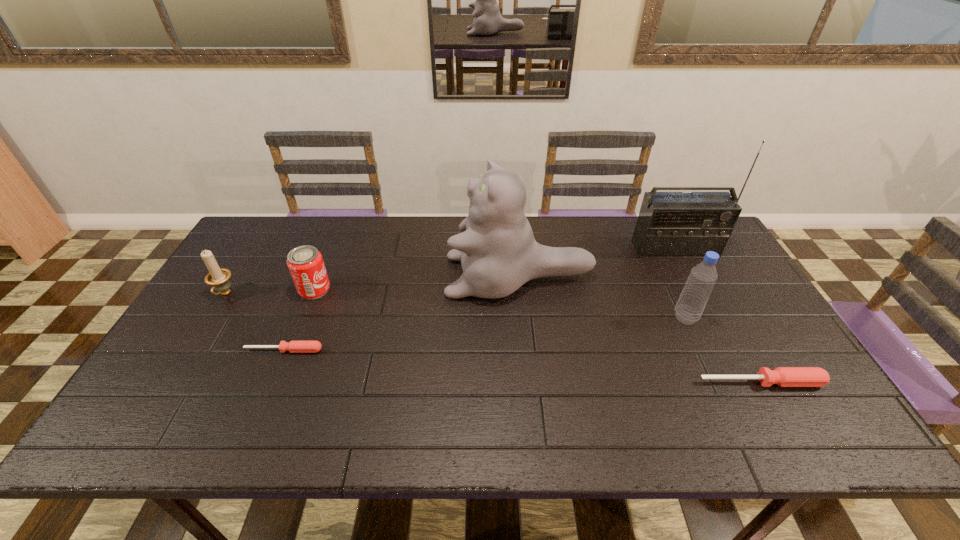
This screenshot has width=960, height=540. In order to click on cat located at the far edge in this screenshot , I will do `click(498, 253)`.

This screenshot has width=960, height=540. I want to click on object that is positioned at the near edge, so click(782, 376).

Where is `object at the left edge`? The height and width of the screenshot is (540, 960). object at the left edge is located at coordinates (219, 278).

This screenshot has width=960, height=540. I want to click on screwdriver present at the right edge, so click(782, 376).

What are the coordinates of `radio receiver present at the right edge` in the screenshot? It's located at (670, 224).

This screenshot has width=960, height=540. Identify the location of object positioned at the far right corner. (670, 224).

Locate an element on the screen. Image resolution: width=960 pixels, height=540 pixels. object that is at the near right corner is located at coordinates (782, 376).

Find the location of `free space at the far edge`. free space at the far edge is located at coordinates (341, 242).

In the image, there is a desktop. At what (x,y) coordinates should I click in order to perform the action: click on vacant space at the left edge. Please return your answer as a coordinate pair (x, y). The image size is (960, 540). Looking at the image, I should click on (247, 288).

Locate an element on the screen. free space at the far left corner of the desktop is located at coordinates (277, 219).